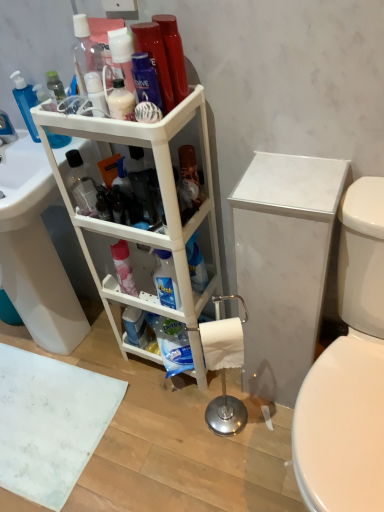
The image size is (384, 512). I want to click on matte plastic lotion at center, positioned as the first toiletry in right-to-left order, so click(x=121, y=102).

The image size is (384, 512). What do you see at coordinates (123, 268) in the screenshot?
I see `pink matte cleaning product at center, which ranks as the first cleaning product in right-to-left order` at bounding box center [123, 268].

The height and width of the screenshot is (512, 384). What do you see at coordinates (35, 250) in the screenshot?
I see `white glossy sink at lower left` at bounding box center [35, 250].

Describe the element at coordinates (135, 326) in the screenshot. This screenshot has height=512, width=384. I see `blue matte container at center, the 1th toiletry positioned from the back` at that location.

You are a GUI agent. You are given a task and a screenshot of the screen. Output one action in this format:
    pyautogui.click(x=<x>, y=<y>)
    Task: Click on the white plastic shelf at center
    
    Given the screenshot: What is the action you would take?
    pyautogui.click(x=163, y=203)

From the image's perspective, is white marble cabinet at right over brushed metal faucet at left?

Actually, white marble cabinet at right appears below brushed metal faucet at left in the image.

Could you tell me if white marble cabinet at right is facing brushed metal faucet at left?

No, white marble cabinet at right is not turned towards brushed metal faucet at left.

How much distance is there between white marble cabinet at right and brushed metal faucet at left?

white marble cabinet at right is 93.93 centimeters from brushed metal faucet at left.

Where is `faucet above the white marble cabinet at right (from the image's perspective)`? faucet above the white marble cabinet at right (from the image's perspective) is located at coordinates (6, 129).

Considering the sizes of objects shiny plastic mouthwash at upper center and white glossy sink at lower left in the image provided, who is taller, shiny plastic mouthwash at upper center or white glossy sink at lower left?

Standing taller between the two is white glossy sink at lower left.

Is shiny plastic mouthwash at upper center in front of or behind white glossy sink at lower left in the image?

In the image, shiny plastic mouthwash at upper center appears in front of white glossy sink at lower left.

Can you tell me how much shiny plastic mouthwash at upper center and white glossy sink at lower left differ in facing direction?

0.655 degrees.

From the image's perspective, is shiny plastic mouthwash at upper center above or below white glossy sink at lower left?

Clearly, from the image's perspective, shiny plastic mouthwash at upper center is above white glossy sink at lower left.

Can you tell me how much pink matte cleaning product at center, which is the 2th cleaning product from left to right, and white paper towel at center differ in facing direction?

There is a 33.9-degree angle between the facing directions of pink matte cleaning product at center, which is the 2th cleaning product from left to right, and white paper towel at center.

Image resolution: width=384 pixels, height=512 pixels. I want to click on cleaning product that is the 1st object located above the white paper towel at center (from the image's perspective), so point(123,268).

From the image's perspective, which one is positioned higher, pink matte cleaning product at center, which is the 2th cleaning product from left to right, or white paper towel at center?

pink matte cleaning product at center, which is the 2th cleaning product from left to right, appears higher in the image.

Which of these two, pink matte cleaning product at center, acting as the 2th cleaning product starting from the top, or white paper towel at center, is smaller?

pink matte cleaning product at center, acting as the 2th cleaning product starting from the top, is smaller.

Choose the correct answer: Is blue matte container at center, marked as the second toiletry in a front-to-back arrangement, inside white glossy sink at lower left or outside it?

blue matte container at center, marked as the second toiletry in a front-to-back arrangement, lies outside white glossy sink at lower left.

Is point (132, 318) positioned after point (6, 236)?

Yes, it is.

Is blue matte container at center, the 1th toiletry positioned from the back, oriented away from white glossy sink at lower left?

No.

In terms of height, does blue matte container at center, marked as the second toiletry in a front-to-back arrangement, look taller or shorter compared to white glossy sink at lower left?

Considering their sizes, blue matte container at center, marked as the second toiletry in a front-to-back arrangement, has less height than white glossy sink at lower left.

Does point (177, 233) lie in front of point (21, 100)?

Yes.

From the image's perspective, is white plastic shelf at center above or below translucent plastic pump bottle at upper left, positioned as the second cleaning product in right-to-left order?

Clearly, from the image's perspective, white plastic shelf at center is below translucent plastic pump bottle at upper left, positioned as the second cleaning product in right-to-left order.

Which cleaning product is the 2nd one when counting from the left side of the white plastic shelf at center? Please provide its 2D coordinates.

[(25, 102)]

Would you say translucent plastic pump bottle at upper left, which appears as the first cleaning product when viewed from the top, is part of white plastic shelf at center's contents?

Actually, translucent plastic pump bottle at upper left, which appears as the first cleaning product when viewed from the top, is outside white plastic shelf at center.

Measure the distance between white glossy sink at lower left and brushed metal faucet at left.

white glossy sink at lower left and brushed metal faucet at left are 15.52 inches apart.

From the image's perspective, is white glossy sink at lower left above brushed metal faucet at left?

No, from the image's perspective, white glossy sink at lower left is not above brushed metal faucet at left.

Does point (22, 292) appear closer or farther from the camera than point (5, 117)?

Point (22, 292).

How different are the orientations of white glossy sink at lower left and brushed metal faucet at left in degrees?

They differ by 4.92 degrees in their facing directions.

Based on their positions, is white glossy sink at lower left located to the left or right of pink matte cleaning product at center, which is the 2th cleaning product from left to right?

white glossy sink at lower left is positioned on pink matte cleaning product at center, which is the 2th cleaning product from left to right,'s left side.

The height and width of the screenshot is (512, 384). Identify the location of cleaning product below the white glossy sink at lower left (from the image's perspective). (123, 268).

Considering the relative sizes of white glossy sink at lower left and pink matte cleaning product at center, which ranks as the first cleaning product in right-to-left order, in the image provided, is white glossy sink at lower left shorter than pink matte cleaning product at center, which ranks as the first cleaning product in right-to-left order,?

No.

Is white glossy sink at lower left thinner than pink matte cleaning product at center, which ranks as the first cleaning product in bottom-to-top order?

Incorrect, the width of white glossy sink at lower left is not less than that of pink matte cleaning product at center, which ranks as the first cleaning product in bottom-to-top order.

I want to click on faucet located on the left of white marble cabinet at right, so click(6, 129).

Where is `mouthwash that is above the white glossy sink at lower left (from a real-world perspective)`? mouthwash that is above the white glossy sink at lower left (from a real-world perspective) is located at coordinates (155, 58).

In the scene shown: When comparing their distances from white matte toilet paper at lower center, does white paper towel at center or shiny plastic mouthwash at upper center seem further?

The object further to white matte toilet paper at lower center is shiny plastic mouthwash at upper center.

Looking at the image, which one is located closer to pink matte cleaning product at center, which is the 2th cleaning product from left to right, matte plastic lotion at center, which is counted as the second toiletry, starting from the left, or white matte toilet paper at lower center?

white matte toilet paper at lower center is closer to pink matte cleaning product at center, which is the 2th cleaning product from left to right.

When comparing their distances from white matte toilet paper at lower center, does shiny plastic mouthwash at upper center or white marble cabinet at right seem further?

Among the two, shiny plastic mouthwash at upper center is located further to white matte toilet paper at lower center.

Estimate the real-world distances between objects in this image. Which object is further from white glossy sink at lower left, white matte toilet paper at lower center or blue matte container at center, which ranks as the 2th toiletry in right-to-left order?

white matte toilet paper at lower center is further to white glossy sink at lower left.

Estimate the real-world distances between objects in this image. Which object is closer to blue matte container at center, marked as the second toiletry in a front-to-back arrangement, white matte toilet paper at lower center or brushed metal faucet at left?

white matte toilet paper at lower center is positioned closer to the anchor blue matte container at center, marked as the second toiletry in a front-to-back arrangement.

When comparing their distances from translucent plastic bottle at center, does white glossy sink at lower left or translucent plastic pump bottle at upper left, the 1th cleaning product viewed from the left, seem further?

Based on the image, white glossy sink at lower left appears to be further to translucent plastic bottle at center.

Based on their spatial positions, is blue matte container at center, arranged as the 2th toiletry when viewed from the top, or white paper towel at center further from white plastic shelf at center?

white paper towel at center is positioned further to the anchor white plastic shelf at center.

Looking at the image, which one is located closer to translucent plastic pump bottle at upper left, positioned as the second cleaning product in right-to-left order, brushed metal faucet at left or translucent plastic bottle at center?

brushed metal faucet at left lies closer to translucent plastic pump bottle at upper left, positioned as the second cleaning product in right-to-left order, than the other object.

Identify the location of shelf between translucent plastic bottle at center and white marble cabinet at right in the up-down direction. This screenshot has width=384, height=512. (163, 203).

Identify the location of toilet paper between white plastic shelf at center and white paper towel at center from top to bottom. (222, 343).

The image size is (384, 512). What are the coordinates of `toiletry that lies between brushed metal faucet at left and blue matte container at center, marked as the second toiletry in a front-to-back arrangement, from top to bottom` in the screenshot? It's located at (121, 102).

The image size is (384, 512). Find the location of `shelf between translucent plastic pump bottle at upper left, the 1th cleaning product viewed from the left, and pink matte cleaning product at center, which ranks as the first cleaning product in right-to-left order, vertically`. shelf between translucent plastic pump bottle at upper left, the 1th cleaning product viewed from the left, and pink matte cleaning product at center, which ranks as the first cleaning product in right-to-left order, vertically is located at coordinates (163, 203).